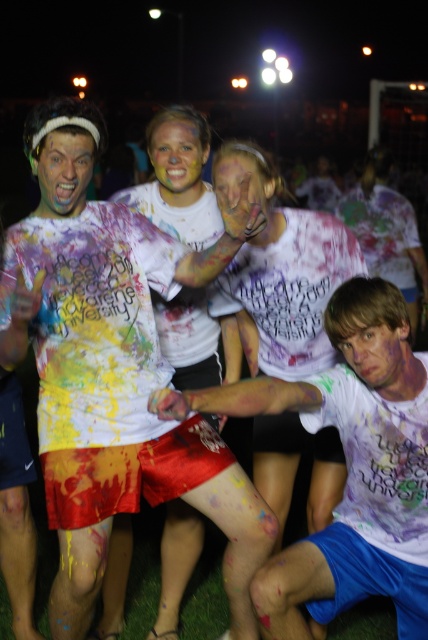
Does shiny plastic face at center appear over smooth skin face at lower right?

Yes, shiny plastic face at center is above smooth skin face at lower right.

Does shiny plastic face at center have a greater height compared to smooth skin face at lower right?

Yes.

Which is in front, point (67, 204) or point (365, 378)?

Point (365, 378) is in front.

The height and width of the screenshot is (640, 428). In order to click on shiny plastic face at center in this screenshot , I will do `click(64, 172)`.

Can you confirm if shiny plastic face at center is taller than yellow matte face paint at center?

Incorrect, shiny plastic face at center's height is not larger of yellow matte face paint at center's.

Does point (68, 211) come behind point (165, 125)?

That is False.

Where is `shiny plastic face at center`? The image size is (428, 640). shiny plastic face at center is located at coordinates [x=64, y=172].

Who is positioned more to the left, yellow matte face paint at center or painted skin face at center?

Positioned to the left is yellow matte face paint at center.

Can you confirm if yellow matte face paint at center is taller than painted skin face at center?

Yes.

Who is more forward, (x=154, y=173) or (x=258, y=172)?

Point (x=258, y=172)

Where is `yellow matte face paint at center`? The image size is (428, 640). yellow matte face paint at center is located at coordinates (178, 161).